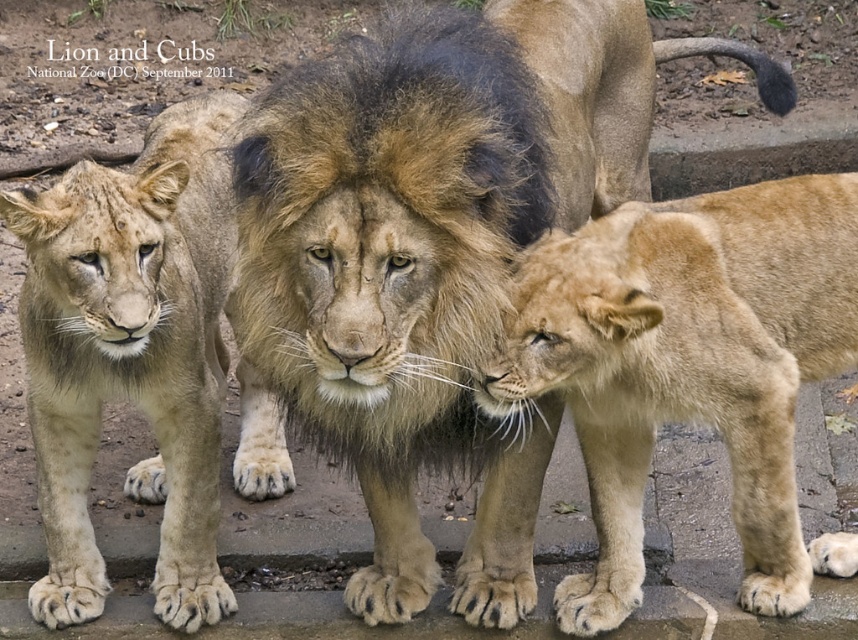
You are a zookeeper at the National Zoo in DC. You need to place a feeding bowl between the golden fur lion at center and the light brown fur at center. The bowl has a diameter of 12 inches. Will there be enough space between them to place the bowl?

The golden fur lion at center is 25.68 inches from light brown fur at center. Since the bowl requires 12 inches of space, there is sufficient space between them to place the bowl.

Looking at this image, based on the scene description, if you were standing in front of the golden fur lion at center and the golden fur lion cub at lower right, which one would you see higher up?

The golden fur lion at center is located above the golden fur lion cub at lower right, so you would see the golden fur lion at center higher up.

You are a zookeeper at the National Zoo in DC and need to place a feeding bowl between the golden fur lion cub at lower right and the light brown fur at center. The bowl has a diameter of 0.5 meters. Will there be enough space between them to place the bowl without moving either animal?

The golden fur lion cub at lower right is 1.26 meters away from the light brown fur at center. Subtracting the bowl diameter of 0.5 meters, there is still 0.76 meters of space remaining between them. Therefore, yes, there is sufficient space to place the bowl between the two animals without needing to move them.